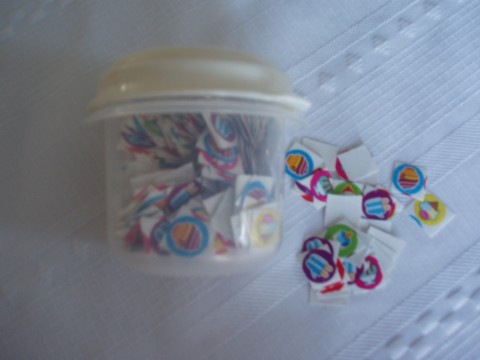
In order to click on stickers inside of cup in this screenshot , I will do `click(180, 229)`, `click(186, 197)`.